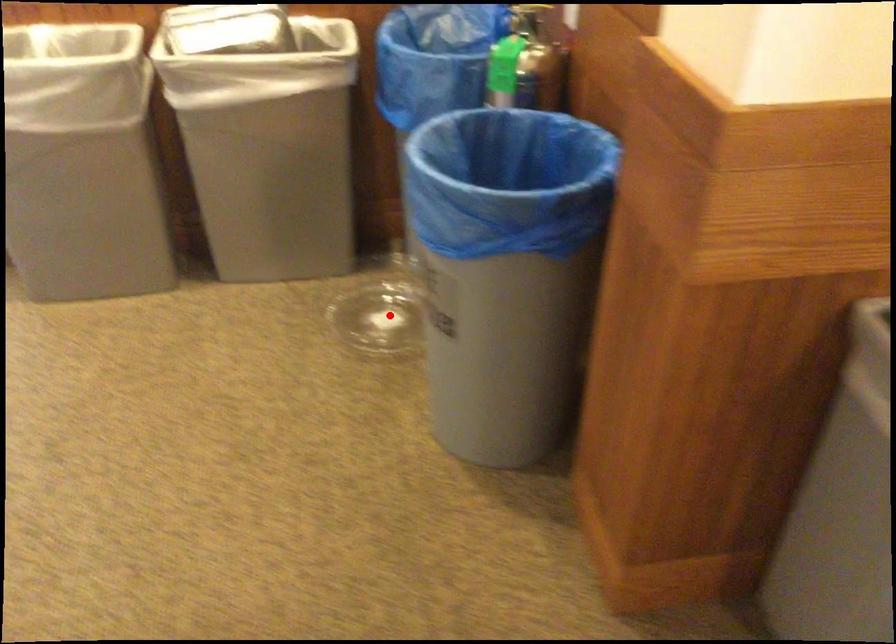
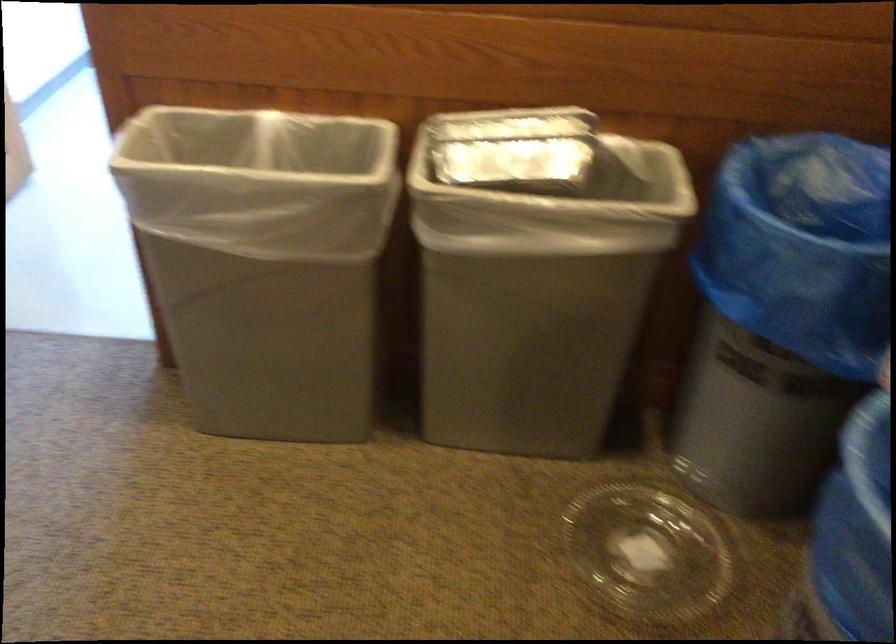
Find the pixel in the second image that matches the highlighted location in the first image.

(648, 552)